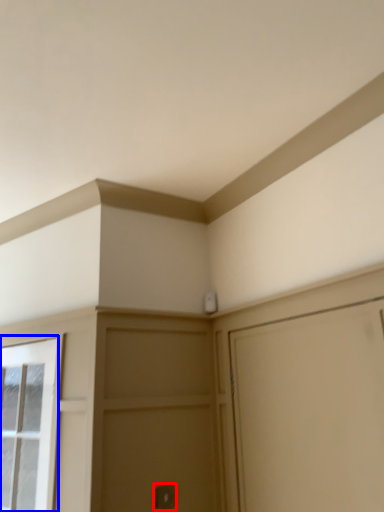
Question: Which object appears closest to the camera in this image, door handle (highlighted by a red box) or window (highlighted by a blue box)?

Choices:
 (A) door handle
 (B) window

Answer: (B)